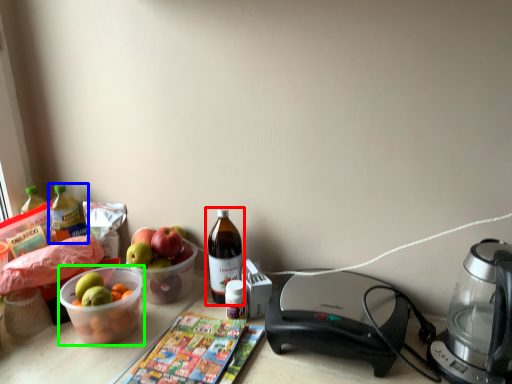
Question: Which is nearer to the bottle (highlighted by a red box)? bottle (highlighted by a blue box) or bowl (highlighted by a green box).

Choices:
 (A) bottle
 (B) bowl

Answer: (B)